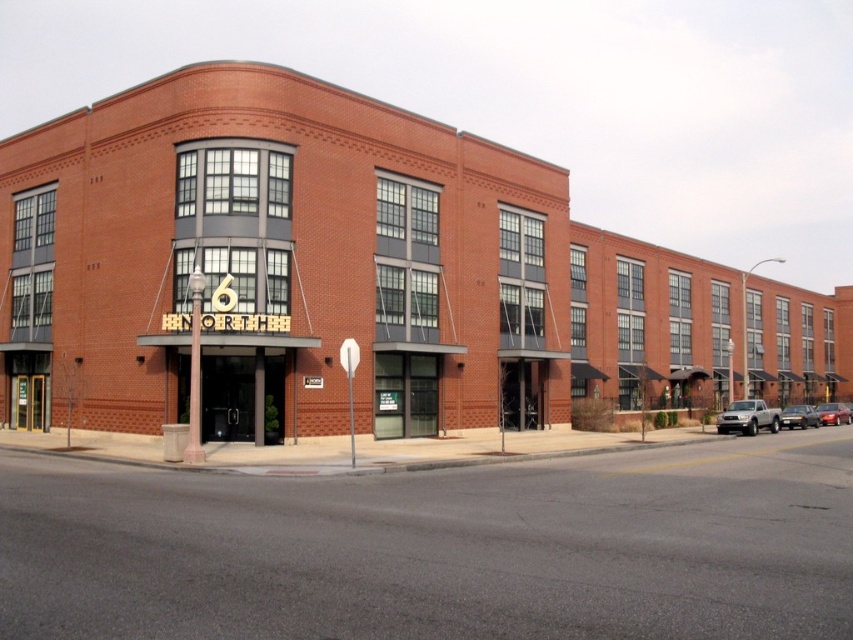
Question: Which of the following is the closest to the observer?

Choices:
 (A) metallic silver sedan at center
 (B) satin silver truck at lower right

Answer: (B)

Question: Which of these objects is positioned closest to the satin silver truck at lower right?

Choices:
 (A) shiny silver sedan at center
 (B) metallic silver sedan at center

Answer: (B)

Question: Does satin silver truck at lower right have a greater width compared to metallic silver sedan at center?

Choices:
 (A) no
 (B) yes

Answer: (A)

Question: Is satin silver truck at lower right wider than shiny silver sedan at center?

Choices:
 (A) yes
 (B) no

Answer: (B)

Question: Does satin silver truck at lower right have a smaller size compared to metallic silver sedan at center?

Choices:
 (A) no
 (B) yes

Answer: (B)

Question: Based on their relative distances, which object is farther from the metallic silver sedan at center?

Choices:
 (A) shiny silver sedan at center
 (B) satin silver truck at lower right

Answer: (A)